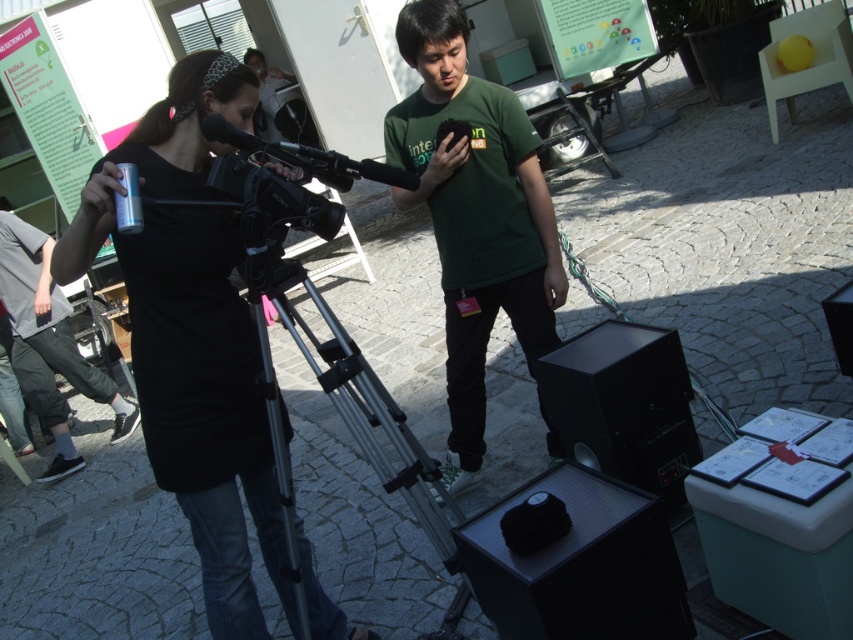
Question: Does green matte shirt at center have a greater width compared to silver metallic tripod at center?

Choices:
 (A) yes
 (B) no

Answer: (A)

Question: Can you confirm if green matte shirt at center is positioned to the right of dark gray pants at lower left?

Choices:
 (A) no
 (B) yes

Answer: (B)

Question: Which object is farther from the camera taking this photo?

Choices:
 (A) matte black camera at center
 (B) silver metallic tripod at center

Answer: (B)

Question: Which object is closer to the camera taking this photo?

Choices:
 (A) matte black camera at center
 (B) silver metallic tripod at center
 (C) dark gray pants at lower left
 (D) green matte shirt at center

Answer: (A)

Question: Estimate the real-world distances between objects in this image. Which object is closer to the green matte shirt at center?

Choices:
 (A) silver metallic tripod at center
 (B) dark gray pants at lower left

Answer: (A)

Question: Where is green matte shirt at center located in relation to silver metallic tripod at center in the image?

Choices:
 (A) right
 (B) left

Answer: (A)